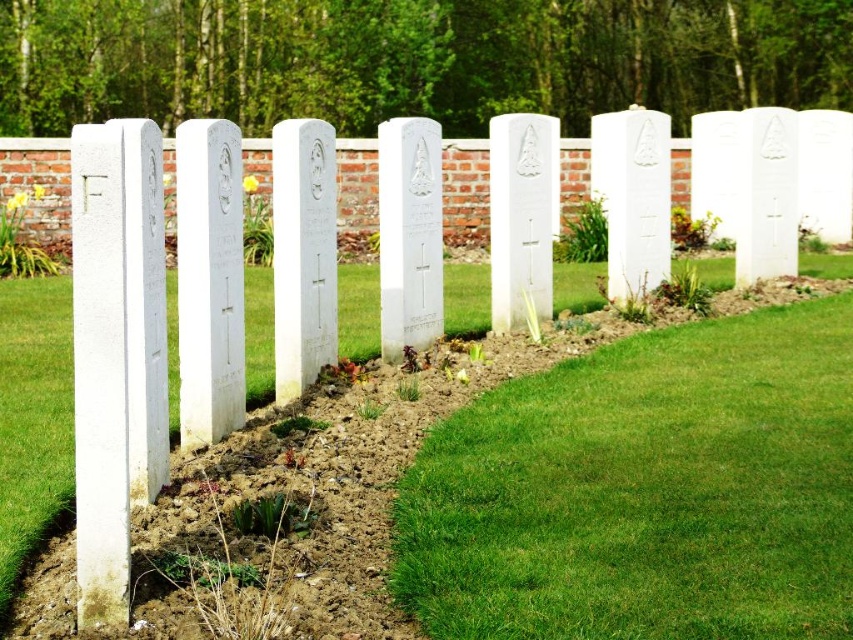
Question: Among these objects, which one is farthest from the camera?

Choices:
 (A) green grass at center
 (B) green grass at lower right

Answer: (A)

Question: Does green grass at center appear under green grass at lower right?

Choices:
 (A) no
 (B) yes

Answer: (A)

Question: Does green grass at center have a larger size compared to green grass at lower right?

Choices:
 (A) no
 (B) yes

Answer: (A)

Question: Does green grass at center have a lesser width compared to green grass at lower right?

Choices:
 (A) no
 (B) yes

Answer: (B)